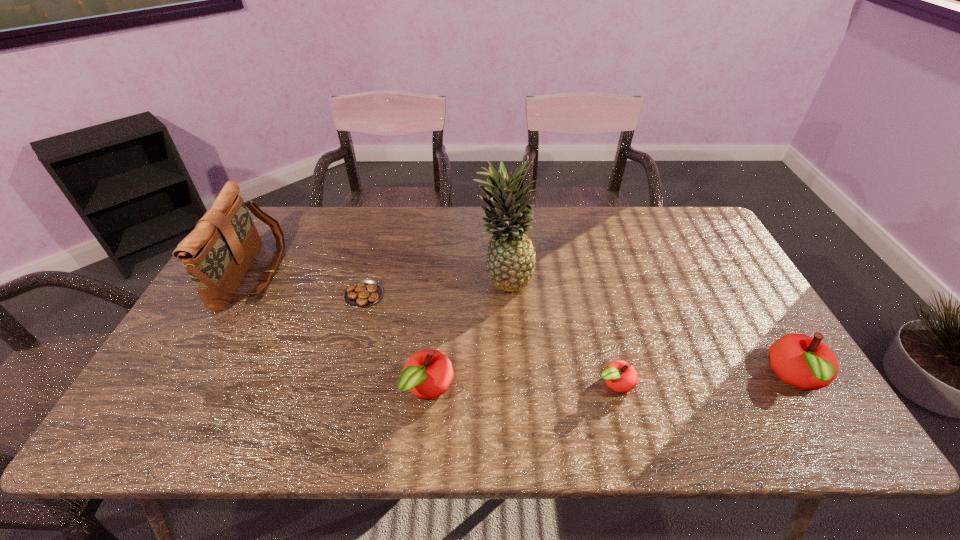
Where is `the fourth object from right to left`? This screenshot has height=540, width=960. the fourth object from right to left is located at coordinates (427, 374).

Where is `the fourth tallest object`? the fourth tallest object is located at coordinates (427, 374).

You are a GUI agent. You are given a task and a screenshot of the screen. Output one action in this format:
    pyautogui.click(x=<x>, y=<y>)
    Task: Click on the fifth tallest object
    Image resolution: width=960 pixels, height=540 pixels.
    Given the screenshot: What is the action you would take?
    pyautogui.click(x=621, y=377)

Where is `the second apple from left to right`? The image size is (960, 540). the second apple from left to right is located at coordinates (621, 377).

This screenshot has height=540, width=960. I want to click on the rightmost object, so coord(806,363).

Where is `the tallest object`? The image size is (960, 540). the tallest object is located at coordinates (510, 261).

Locate an element on the screen. The width and height of the screenshot is (960, 540). the third object from right to left is located at coordinates (510, 261).

I want to click on pastry, so click(363, 293).

This screenshot has height=540, width=960. What are the coordinates of `the fifth object from right to left` in the screenshot? It's located at (363, 293).

I want to click on the leftmost object, so click(x=217, y=254).